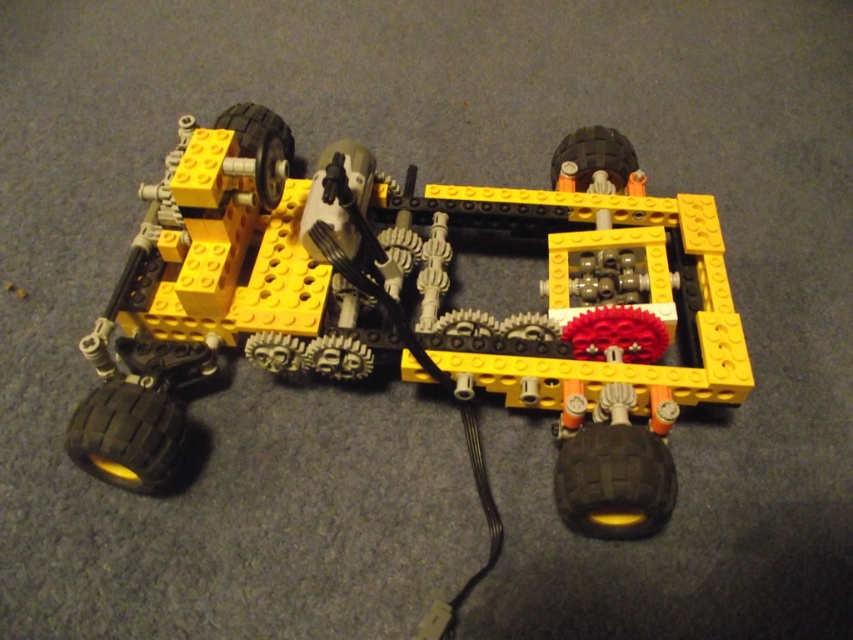
You are a toy collector who wants to store the yellow plastic car at center and the black rubber tire at lower right in a vertical storage unit. The storage unit has a height limit of 15 cm. Can both items be stored vertically without exceeding the height limit?

The yellow plastic car at center has a greater height compared to the black rubber tire at lower right. Since the storage unit has a height limit of 15 cm, the yellow plastic car at center must be under 15 cm in height to fit. However, since the exact height of the car isn